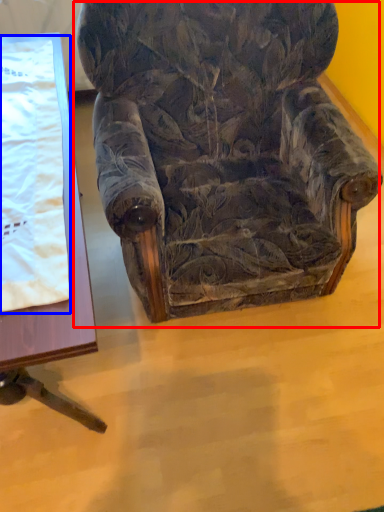
Question: Which of the following is the closest to the observer, chair (highlighted by a red box) or blanket (highlighted by a blue box)?

Choices:
 (A) chair
 (B) blanket

Answer: (A)